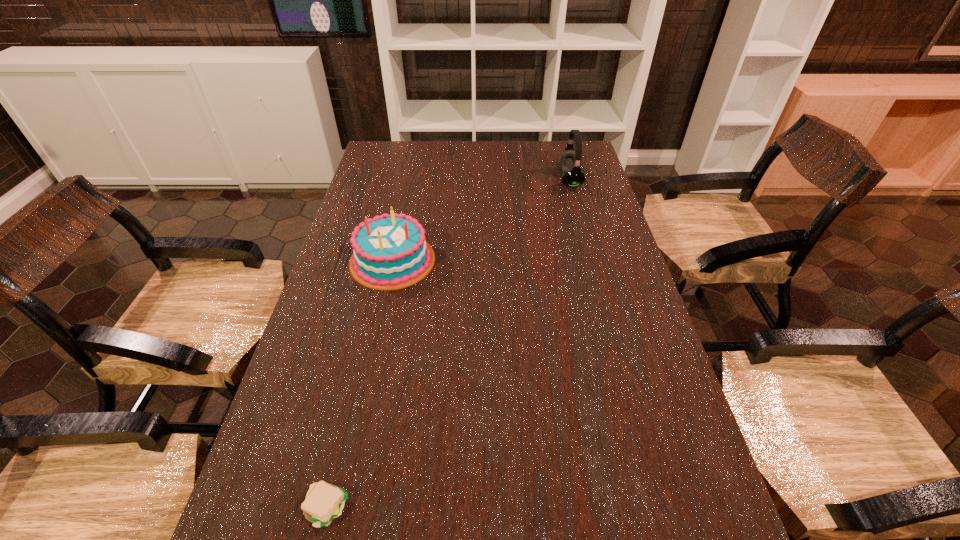
Locate an element on the screen. the farthest object is located at coordinates (569, 161).

The image size is (960, 540). In order to click on headset in this screenshot , I will do `click(569, 161)`.

This screenshot has width=960, height=540. Find the location of `the second tallest object`. the second tallest object is located at coordinates (389, 252).

Where is `birthday cake`? This screenshot has width=960, height=540. birthday cake is located at coordinates tap(389, 252).

At what (x,y) coordinates should I click in order to perform the action: click on patty. Please return your answer as a coordinate pair (x, y). This screenshot has height=540, width=960. Looking at the image, I should click on (324, 502).

I want to click on the shortest object, so click(324, 502).

Find the location of `vacant space located 0.130m on the ear cups of the rightmost object`. vacant space located 0.130m on the ear cups of the rightmost object is located at coordinates (523, 180).

Find the location of `blank space located 0.090m on the ear cups of the rightmost object`. blank space located 0.090m on the ear cups of the rightmost object is located at coordinates click(534, 180).

This screenshot has width=960, height=540. I want to click on vacant region located 0.220m on the ear cups of the rightmost object, so click(x=499, y=180).

Where is `free location located 0.360m on the back of the birthday cake`? The width and height of the screenshot is (960, 540). free location located 0.360m on the back of the birthday cake is located at coordinates (411, 176).